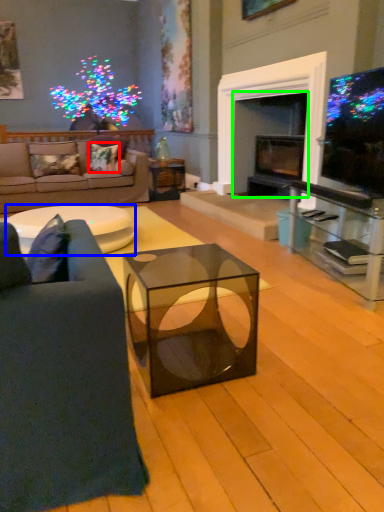
Question: Estimate the real-world distances between objects in this image. Which object is farther from pillow (highlighted by a red box), table (highlighted by a blue box) or fireplace (highlighted by a green box)?

Choices:
 (A) table
 (B) fireplace

Answer: (B)